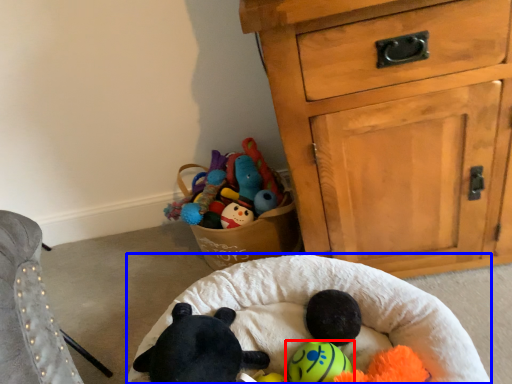
Question: Which point is further to the camera, toy (highlighted by a red box) or infant bed (highlighted by a blue box)?

Choices:
 (A) toy
 (B) infant bed

Answer: (A)